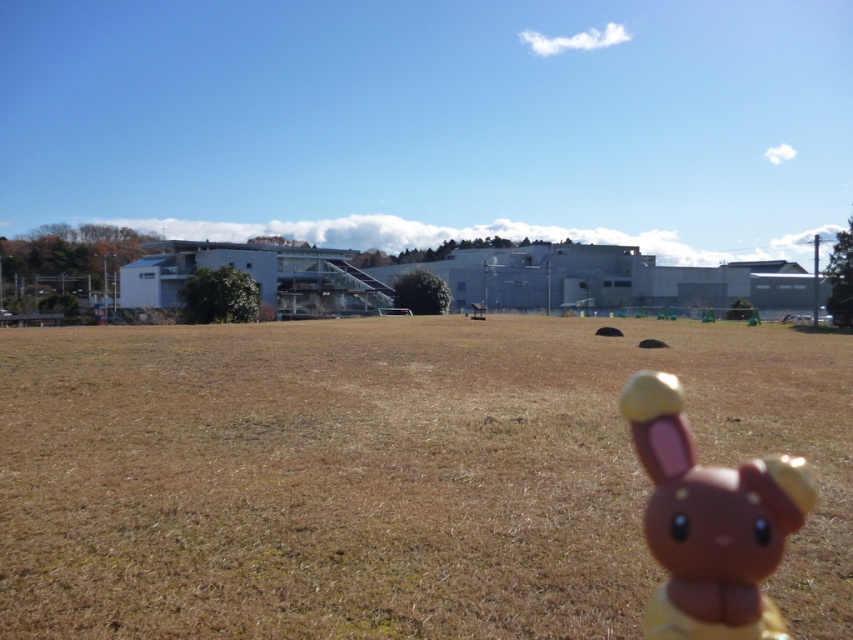
You are standing in the open grassy field depicted in the scene. You see the brown grass at center and the brown matte plush toy at lower right. Which object is positioned to the right of the other?

The brown grass at center is to the right of the brown matte plush toy at lower right.

You are standing at the point with coordinates (386, 474) in the open grassy field. What do you see directly beneath your feet?

You see brown grass at center directly beneath your feet at point (386, 474).